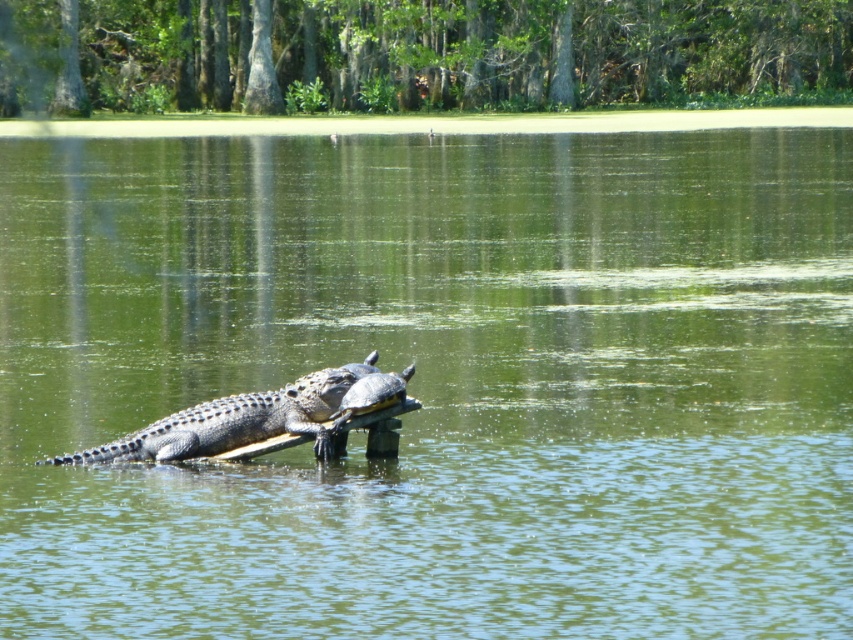
Question: Which of the following is the closest to the observer?

Choices:
 (A) (363, 385)
 (B) (137, 458)

Answer: (A)

Question: Which of the following is the farthest from the observer?

Choices:
 (A) (193, 456)
 (B) (387, 384)

Answer: (A)

Question: Where is leathery brown crocodile at center located in relation to smooth gray crocodile at center in the image?

Choices:
 (A) below
 (B) above

Answer: (A)

Question: Does leathery brown crocodile at center have a greater width compared to smooth gray crocodile at center?

Choices:
 (A) no
 (B) yes

Answer: (B)

Question: Is leathery brown crocodile at center below smooth gray crocodile at center?

Choices:
 (A) yes
 (B) no

Answer: (A)